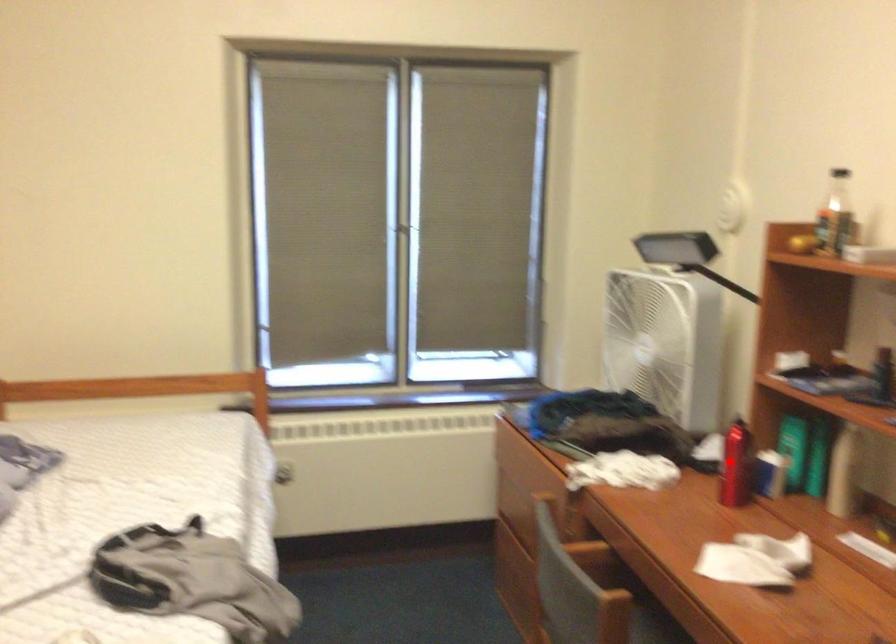
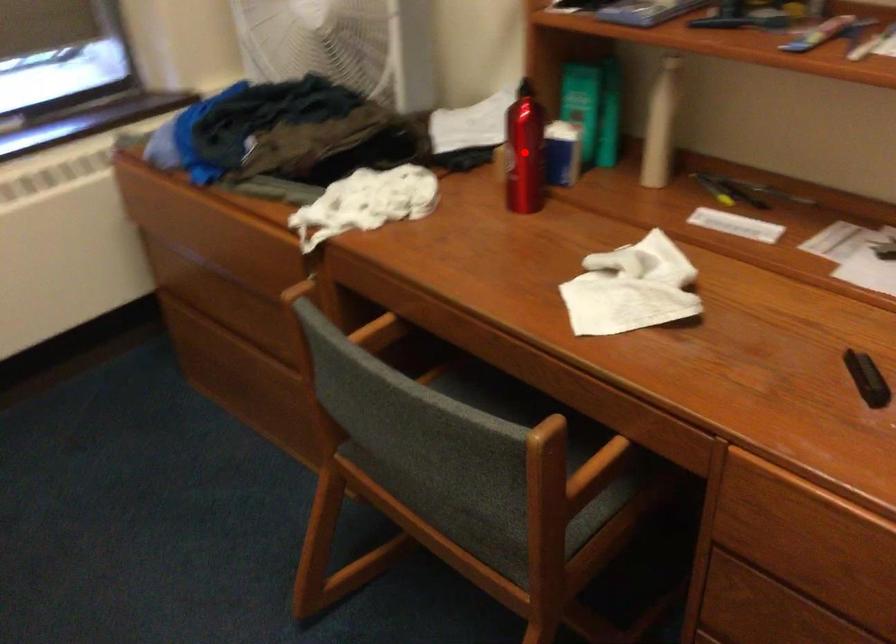
I am providing you with two images of the same scene from different viewpoints. A red point is marked on the first image and another point is marked on the second image. Do the highlighted points in image1 and image2 indicate the same real-world spot?

Yes